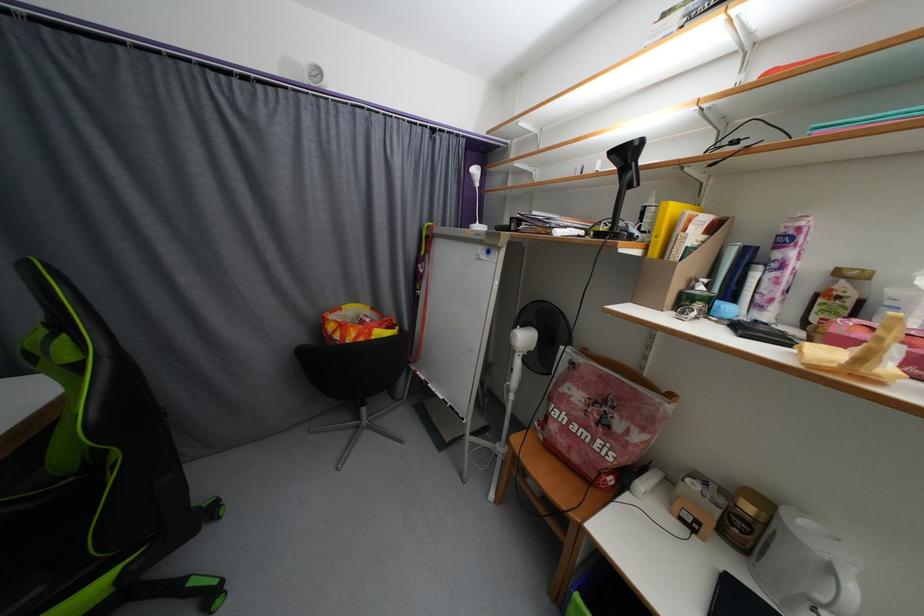
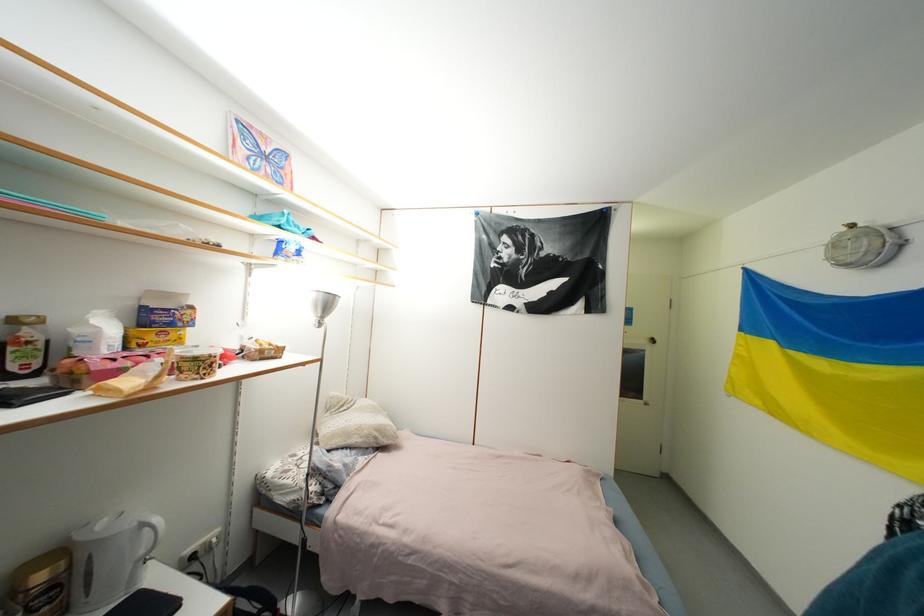
Find the pixel in the second image that matches the point at 837,573 in the first image.

(149, 528)